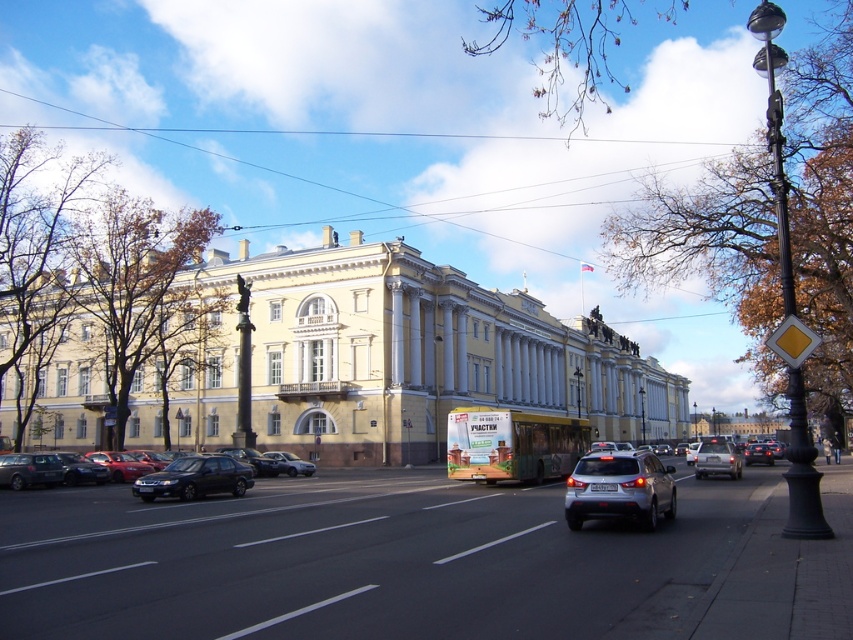
You are a pedestrian standing on the sidewalk near the classical building. You want to cross the street to reach the park on the other side. There are two cars in your path. Which car is closer to the classical building, the matte black sedan at lower left or the satin silver sedan at center?

The matte black sedan at lower left is closer to the classical building because it is positioned to the left of the satin silver sedan at center, and since you are standing near the building on the left side of the street, the leftmost car would be nearest to the building.

You are standing at the point labeled as point [619,488] in the image. What object are you currently standing on?

The point labeled as point [619,488] is on the satin silver suv at center, so you are standing on the satin silver suv at center.

You are a pedestrian standing at the matte black sedan at lower left and want to cross the street to reach the large classical building on the left. The road has a speed limit of 30 km per hour. Can you safely cross the road before the satin silver suv at center arrives?

The distance between the satin silver suv at center and the matte black sedan at lower left is 19.26 meters. At a speed of 30 km per hour, the suv would take approximately 22 seconds to cover that distance. Since pedestrians typically take about 10 seconds to cross a street, you have enough time to safely cross before the suv arrives.